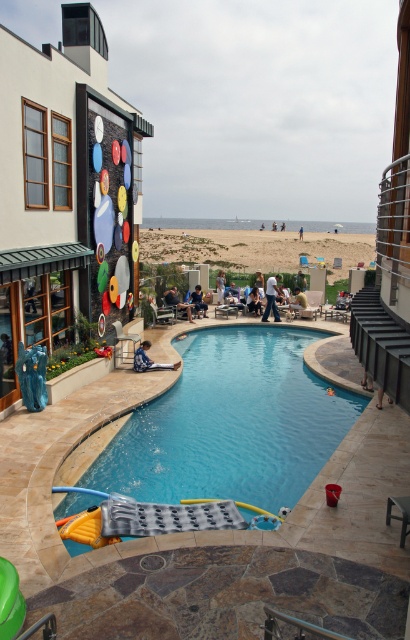
You are a lifeguard standing at the edge of the pool and you need to quickly grab an item from the blue denim jeans at center and the blue fabric chair at center. Which item is easier to reach because it has a smaller width?

The blue denim jeans at center is thinner than the blue fabric chair at center, so the blue denim jeans at center is easier to reach due to its smaller width.

You are standing at the poolside and see the point marked at coordinates (150, 358) in the image. What object is located at that point?

The point at coordinates (150, 358) marks blue denim shorts at lower left.

You are planning to place a new light brown wooden chair at lower right next to the blue smooth pool at center. Considering the pool is wider than the chair, would the chair fit comfortably without being too close to the edge of the pool?

The blue smooth pool at center is wider than the light brown wooden chair at lower right, so placing the chair next to it would allow enough space for comfort and safety. The chair should fit comfortably without being too close to the edge.